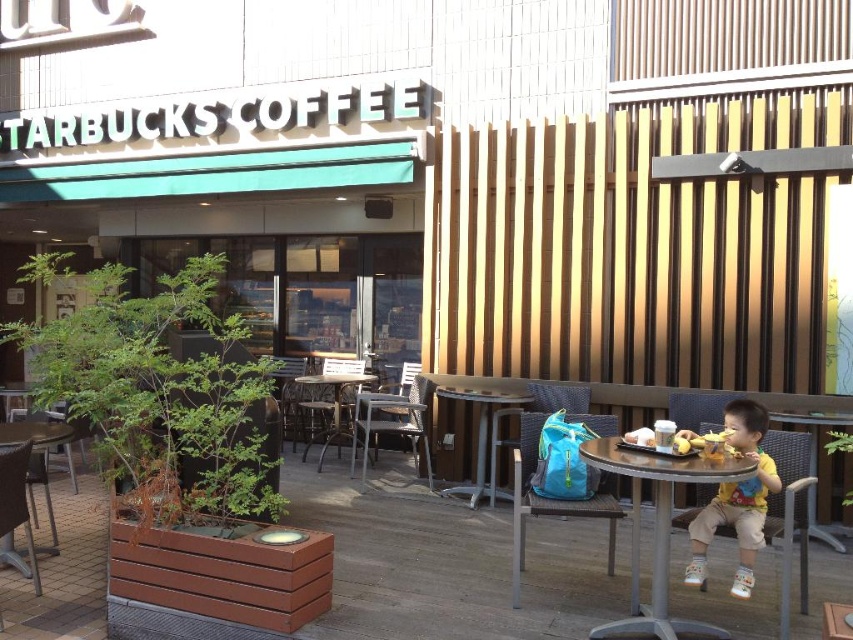
You are a customer at the Starbucks Coffee shop and want to sit down. You see the matte brown chair at center and the metallic silver table at center. Which object is bigger in size?

The matte brown chair at center is larger in size compared to the metallic silver table at center.

You are a customer at the Starbucks Coffee shop and want to sit down. There is a matte brown chair at center and a metallic silver table at center. Which object should you approach first if you want to sit in the chair?

You should approach the metallic silver table at center first because the matte brown chair at center is to the right of it, so you need to navigate around the table to reach the chair.

You are standing at the Starbucks Coffee shop and want to take a photo of the two points mentioned. Which point, point (679, 624) or point (746, 435), will appear larger in your camera view?

Point (679, 624) will appear larger in your camera view because it is closer to the camera than point (746, 435).